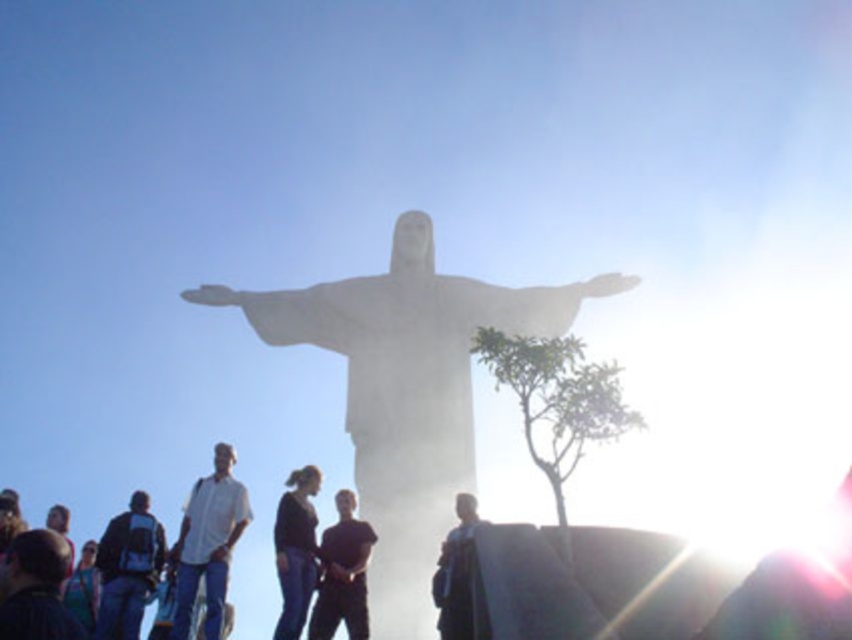
Which of these two, white matte shirt at center or matte black backpack at lower left, stands taller?

white matte shirt at center is taller.

Between point (220, 508) and point (144, 509), which one is positioned in front?

Point (220, 508) is in front.

Measure the distance between point (203, 625) and camera.

A distance of 107.68 meters exists between point (203, 625) and camera.

This screenshot has width=852, height=640. Identify the location of white matte shirt at center. (208, 545).

Is matte black backpack at lower left above black matte shirt at center?

No, matte black backpack at lower left is not above black matte shirt at center.

What are the coordinates of `matte black backpack at lower left` in the screenshot? It's located at pyautogui.click(x=127, y=568).

You are a GUI agent. You are given a task and a screenshot of the screen. Output one action in this format:
    pyautogui.click(x=<x>, y=<y>)
    Task: Click on the matte black backpack at lower left
    The image size is (852, 640).
    Given the screenshot: What is the action you would take?
    pyautogui.click(x=127, y=568)

Who is shorter, white matte shirt at center or dark blue jeans at lower left?

dark blue jeans at lower left

Between white matte shirt at center and dark blue jeans at lower left, which one appears on the left side from the viewer's perspective?

Positioned to the left is dark blue jeans at lower left.

This screenshot has height=640, width=852. In order to click on white matte shirt at center in this screenshot , I will do `click(208, 545)`.